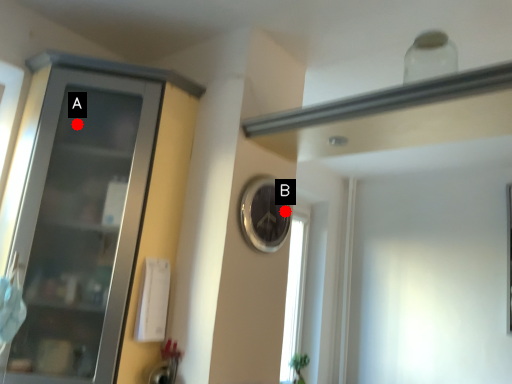
Question: Two points are circled on the image, labeled by A and B beside each circle. Among these points, which one is nearest to the camera?

Choices:
 (A) A is closer
 (B) B is closer

Answer: (A)